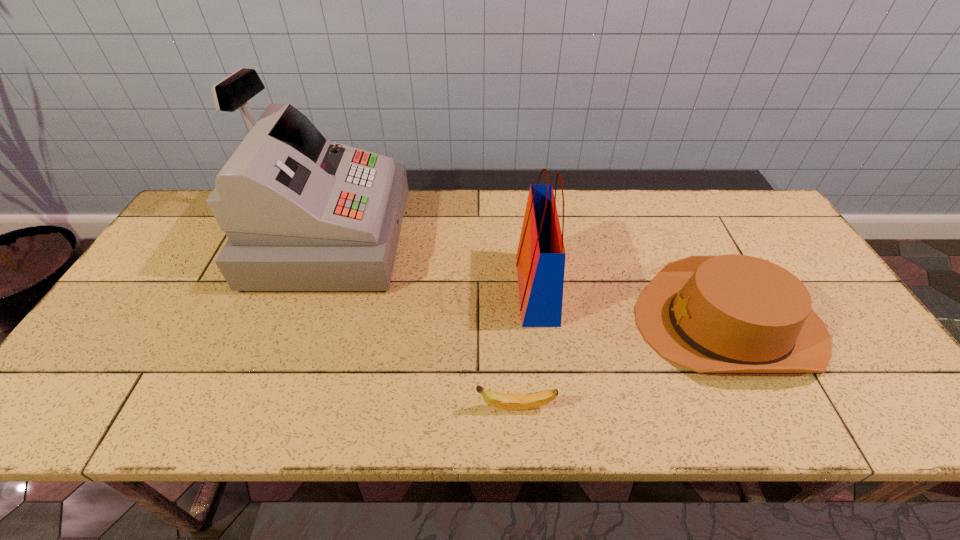
Identify the location of vacant region at the near edge of the desktop. This screenshot has height=540, width=960. (504, 420).

Locate an element on the screen. This screenshot has height=540, width=960. vacant space at the near right corner is located at coordinates (849, 397).

Find the location of a particular element. The image size is (960, 540). free space between the rightmost object and the third shortest object is located at coordinates (633, 307).

Find the location of a particular element. The height and width of the screenshot is (540, 960). free area in between the cowboy hat and the shortest object is located at coordinates (622, 366).

Locate an element on the screen. The width and height of the screenshot is (960, 540). blank region between the banana and the shopping bag is located at coordinates (526, 349).

The image size is (960, 540). I want to click on blank region between the second tallest object and the shortest object, so click(x=526, y=349).

Where is `vacant area that lies between the second tallest object and the cowboy hat`? The image size is (960, 540). vacant area that lies between the second tallest object and the cowboy hat is located at coordinates (633, 307).

Locate an element on the screen. free point between the third shortest object and the cowboy hat is located at coordinates (633, 307).

I want to click on vacant point located between the third shortest object and the leftmost object, so click(433, 264).

Find the location of `free space between the second tallest object and the second shortest object`. free space between the second tallest object and the second shortest object is located at coordinates (633, 307).